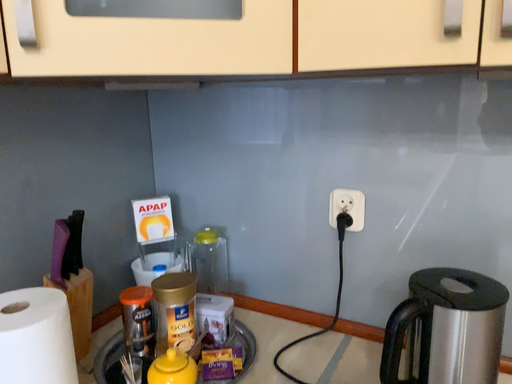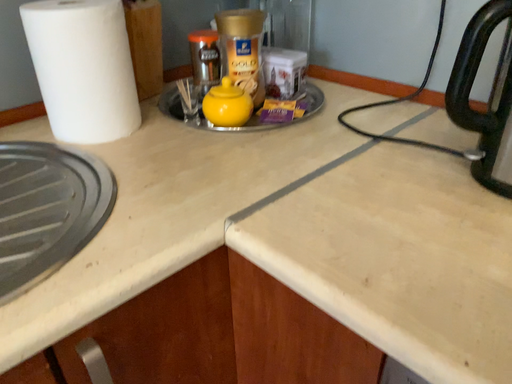
Question: How did the camera likely rotate when shooting the video?

Choices:
 (A) rotated left
 (B) rotated right

Answer: (A)